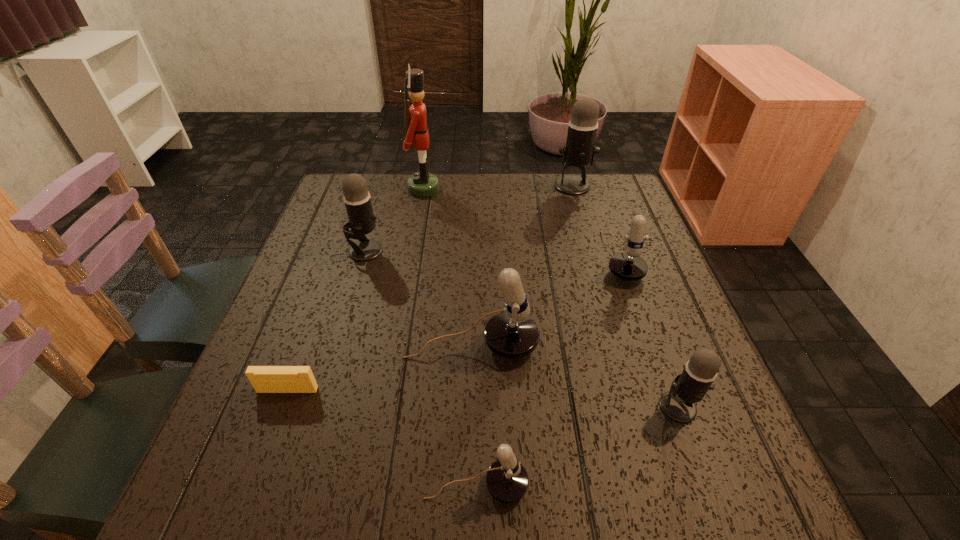
Locate which white microphone is the second closest to the nearest microphone. Please provide its 2D coordinates. Your answer should be formatted as a tuple, i.e. [(x, y)], where the tuple contains the x and y coordinates of a point satisfying the conditions above.

[(629, 266)]

Select which white microphone appears as the third closest to the leftmost microphone. Please provide its 2D coordinates. Your answer should be formatted as a tuple, i.e. [(x, y)], where the tuple contains the x and y coordinates of a point satisfying the conditions above.

[(629, 266)]

I want to click on vacant region that satisfies the following two spatial constraints: 1. on the front-facing side of the green nutcracker; 2. on the right side of the shortest microphone, so click(372, 485).

Locate an element on the screen. vacant space that satisfies the following two spatial constraints: 1. on the back side of the nearest gray microphone; 2. on the left side of the nearest white microphone is located at coordinates (477, 407).

Where is `free location that satisfies the following two spatial constraints: 1. on the back side of the second nearest microphone; 2. on the front-facing side of the tallest object`? free location that satisfies the following two spatial constraints: 1. on the back side of the second nearest microphone; 2. on the front-facing side of the tallest object is located at coordinates (598, 188).

Image resolution: width=960 pixels, height=540 pixels. Find the location of `free space in the image that satisfies the following two spatial constraints: 1. on the front-facing side of the biggest white microphone; 2. on the left side of the nutcracker`. free space in the image that satisfies the following two spatial constraints: 1. on the front-facing side of the biggest white microphone; 2. on the left side of the nutcracker is located at coordinates (396, 345).